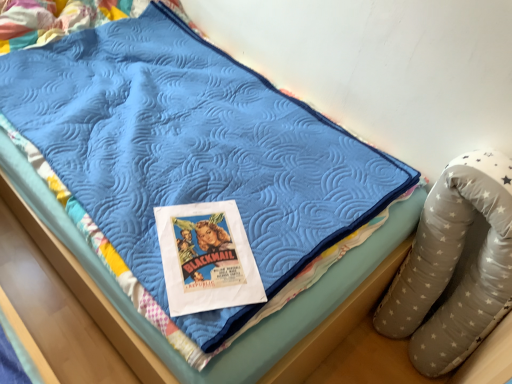
At what (x,y) coordinates should I click in order to perform the action: click on matte paper poster at center. Please return your answer as a coordinate pair (x, y). Looking at the image, I should click on (206, 258).

What do you see at coordinates (206, 258) in the screenshot? I see `matte paper poster at center` at bounding box center [206, 258].

What is the approximate height of gray star-patterned bean bag chair at right?

30.25 inches.

Describe the element at coordinates (454, 266) in the screenshot. I see `gray star-patterned bean bag chair at right` at that location.

Image resolution: width=512 pixels, height=384 pixels. Identify the location of gray star-patterned bean bag chair at right. (454, 266).

The image size is (512, 384). In order to click on matte paper poster at center in this screenshot , I will do `click(206, 258)`.

Considering the relative positions of gray star-patterned bean bag chair at right and matte paper poster at center in the image provided, is gray star-patterned bean bag chair at right to the left or to the right of matte paper poster at center?

gray star-patterned bean bag chair at right is positioned on matte paper poster at center's right side.

Which object is closer to the camera taking this photo, gray star-patterned bean bag chair at right or matte paper poster at center?

Positioned in front is gray star-patterned bean bag chair at right.

Between point (474, 265) and point (174, 272), which one is positioned in front?

Point (174, 272)

Looking at this image, from the image's perspective, is gray star-patterned bean bag chair at right beneath matte paper poster at center?

Yes.

From a real-world perspective, between gray star-patterned bean bag chair at right and matte paper poster at center, who is vertically higher?

From a 3D spatial view, matte paper poster at center is above.

Does gray star-patterned bean bag chair at right have a greater width compared to matte paper poster at center?

Incorrect, the width of gray star-patterned bean bag chair at right does not surpass that of matte paper poster at center.

Can you confirm if gray star-patterned bean bag chair at right is taller than matte paper poster at center?

Yes.

Consider the image. Which of these two, gray star-patterned bean bag chair at right or matte paper poster at center, is bigger?

With larger size is gray star-patterned bean bag chair at right.

Looking at this image, do you think gray star-patterned bean bag chair at right is within matte paper poster at center, or outside of it?

gray star-patterned bean bag chair at right is not enclosed by matte paper poster at center.

Is gray star-patterned bean bag chair at right positioned far away from matte paper poster at center?

That's not correct — gray star-patterned bean bag chair at right is a little close to matte paper poster at center.

Could you tell me if gray star-patterned bean bag chair at right is facing matte paper poster at center?

No, gray star-patterned bean bag chair at right is not facing towards matte paper poster at center.

How much distance is there between gray star-patterned bean bag chair at right and matte paper poster at center?

They are 25.43 inches apart.

At what (x,y) coordinates should I click in order to perform the action: click on bean bag chair below the matte paper poster at center (from the image's perspective). Please return your answer as a coordinate pair (x, y). The image size is (512, 384). Looking at the image, I should click on (454, 266).

Considering the positions of objects matte paper poster at center and gray star-patterned bean bag chair at right in the image provided, who is more to the left, matte paper poster at center or gray star-patterned bean bag chair at right?

From the viewer's perspective, matte paper poster at center appears more on the left side.

From the picture: Does matte paper poster at center come in front of gray star-patterned bean bag chair at right?

No, it is behind gray star-patterned bean bag chair at right.

Which is more distant, (188, 214) or (498, 172)?

Point (188, 214)

From the image's perspective, is matte paper poster at center located above gray star-patterned bean bag chair at right?

Correct, matte paper poster at center appears higher than gray star-patterned bean bag chair at right in the image.

From a real-world perspective, does matte paper poster at center stand above gray star-patterned bean bag chair at right?

Yes, from a real-world perspective, matte paper poster at center is above gray star-patterned bean bag chair at right.

Considering the sizes of matte paper poster at center and gray star-patterned bean bag chair at right in the image, is matte paper poster at center wider or thinner than gray star-patterned bean bag chair at right?

Clearly, matte paper poster at center has more width compared to gray star-patterned bean bag chair at right.

Is matte paper poster at center shorter than gray star-patterned bean bag chair at right?

Indeed, matte paper poster at center has a lesser height compared to gray star-patterned bean bag chair at right.

Considering the sizes of objects matte paper poster at center and gray star-patterned bean bag chair at right in the image provided, who is smaller, matte paper poster at center or gray star-patterned bean bag chair at right?

Smaller between the two is matte paper poster at center.

Which is correct: matte paper poster at center is inside gray star-patterned bean bag chair at right, or outside of it?

matte paper poster at center is not inside gray star-patterned bean bag chair at right, it's outside.

Is matte paper poster at center not near gray star-patterned bean bag chair at right?

That's not correct — matte paper poster at center is a little close to gray star-patterned bean bag chair at right.

Is matte paper poster at center aimed at gray star-patterned bean bag chair at right?

No, matte paper poster at center is not facing towards gray star-patterned bean bag chair at right.

Where is `comic book that is behind the gray star-patterned bean bag chair at right`? comic book that is behind the gray star-patterned bean bag chair at right is located at coordinates (206, 258).

Where is `comic book above the gray star-patterned bean bag chair at right (from a real-world perspective)`? comic book above the gray star-patterned bean bag chair at right (from a real-world perspective) is located at coordinates (206, 258).

Image resolution: width=512 pixels, height=384 pixels. Find the location of `bean bag chair that is below the matte paper poster at center (from the image's perspective)`. bean bag chair that is below the matte paper poster at center (from the image's perspective) is located at coordinates (454, 266).